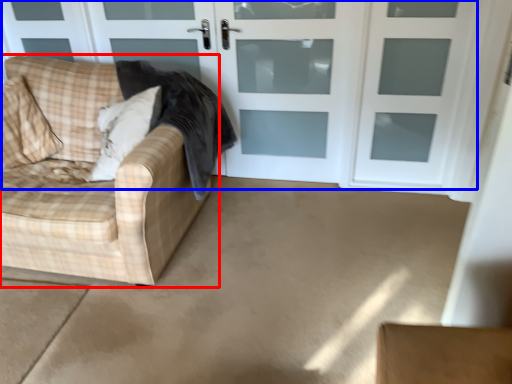
Question: Which of the following is the closest to the observer, studio couch (highlighted by a red box) or door (highlighted by a blue box)?

Choices:
 (A) studio couch
 (B) door

Answer: (A)